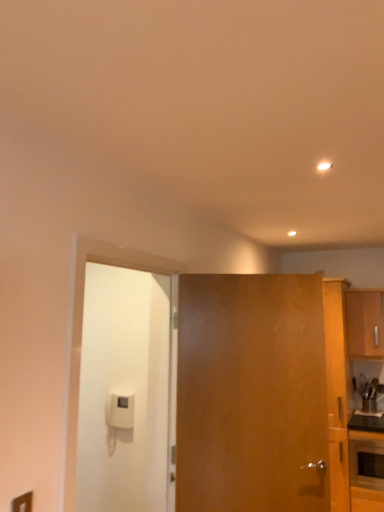
Question: Is matte black oven at lower right spatially inside wooden cabinet at right, or outside of it?

Choices:
 (A) inside
 (B) outside

Answer: (B)

Question: Considering the positions of matte black oven at lower right and wooden cabinet at right in the image, is matte black oven at lower right wider or thinner than wooden cabinet at right?

Choices:
 (A) thin
 (B) wide

Answer: (A)

Question: Estimate the real-world distances between objects in this image. Which object is closer to the wooden door at center, which is the first door in right-to-left order?

Choices:
 (A) matte black oven at lower right
 (B) white matte door at left, the 1th door in the left-to-right sequence
 (C) wooden cabinet at right

Answer: (B)

Question: Estimate the real-world distances between objects in this image. Which object is farther from the white matte door at left, the 1th door in the left-to-right sequence?

Choices:
 (A) matte black oven at lower right
 (B) wooden door at center, which is the first door in right-to-left order
 (C) wooden cabinet at right

Answer: (C)